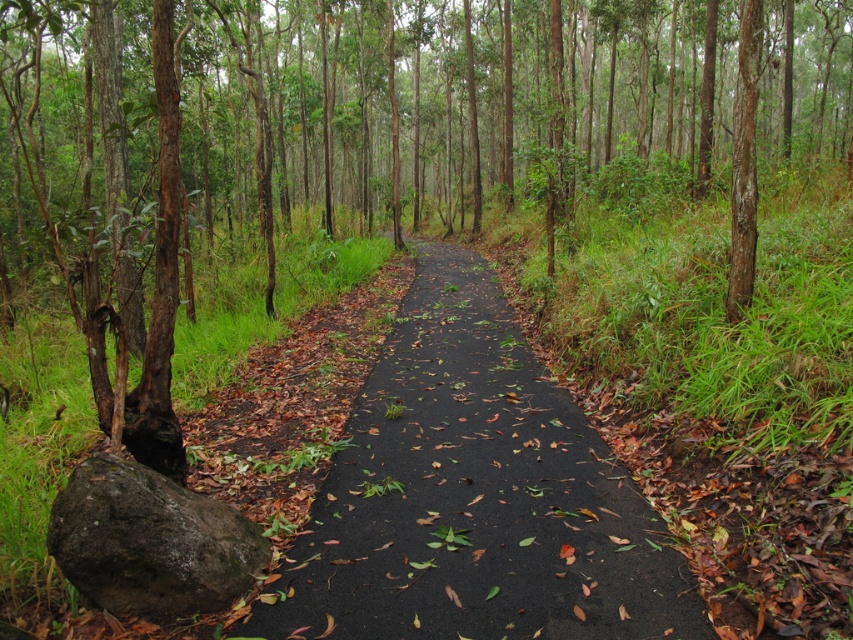
Question: Can you confirm if black asphalt path at center is smaller than green mossy rock at lower left?

Choices:
 (A) no
 (B) yes

Answer: (B)

Question: Does black asphalt path at center appear on the right side of green mossy rock at lower left?

Choices:
 (A) yes
 (B) no

Answer: (A)

Question: Which object appears closest to the camera in this image?

Choices:
 (A) green mossy rock at lower left
 (B) black asphalt path at center

Answer: (B)

Question: Which point appears closest to the camera in this image?

Choices:
 (A) (195, 506)
 (B) (459, 584)

Answer: (B)

Question: Is black asphalt path at center positioned behind green mossy rock at lower left?

Choices:
 (A) yes
 (B) no

Answer: (B)